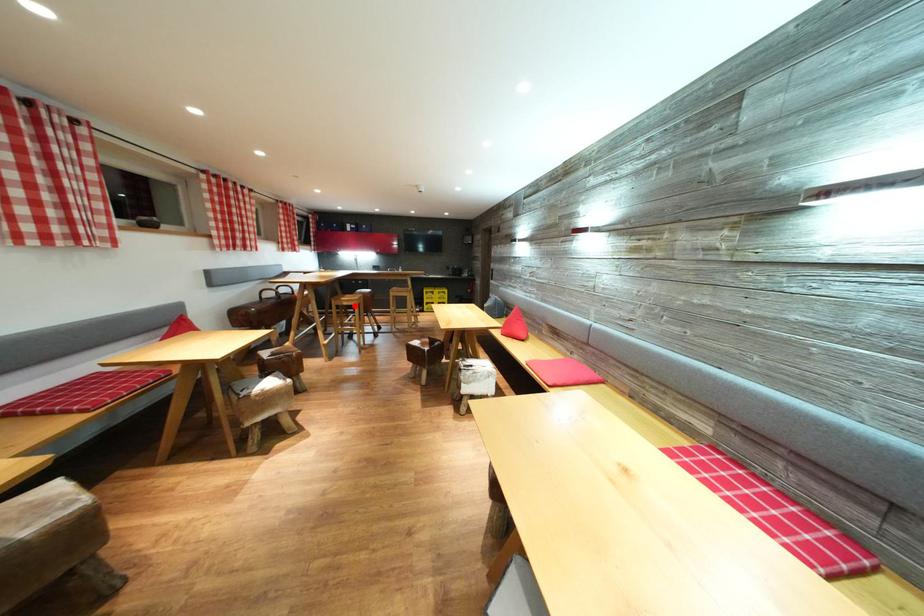
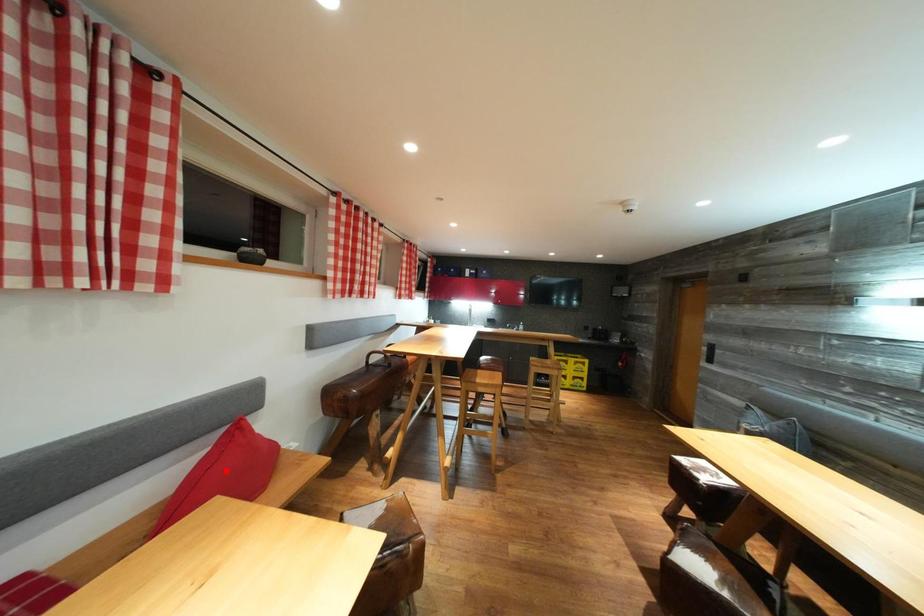
I am providing you with two images of the same scene from different viewpoints. A red point is marked on the first image and another point is marked on the second image. Is the red point in image1 aligned with the point shown in image2?

No